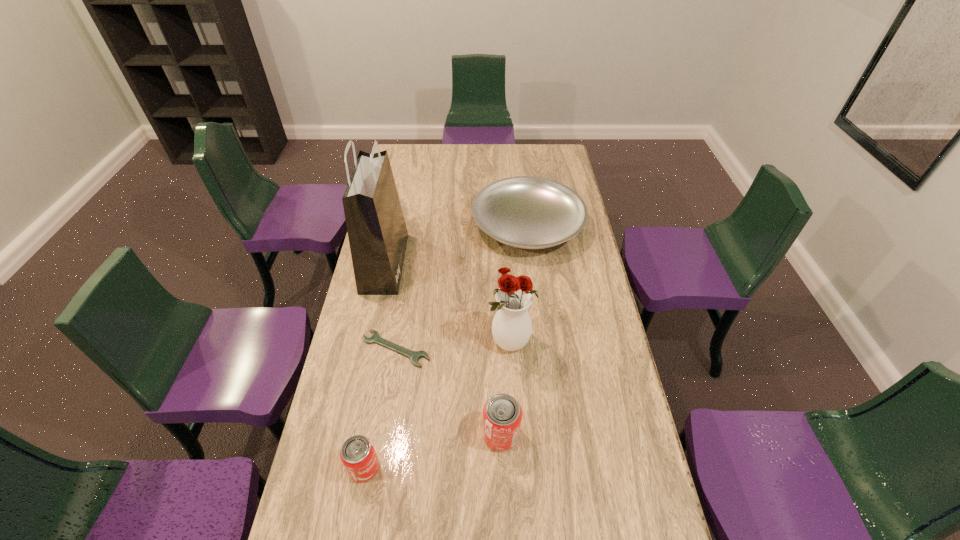
I want to click on vacant space at the left edge of the desktop, so click(321, 440).

This screenshot has width=960, height=540. In order to click on free space at the right edge of the desktop in this screenshot , I will do `click(640, 478)`.

The width and height of the screenshot is (960, 540). In order to click on vacant space at the far right corner of the desktop in this screenshot , I will do `click(544, 156)`.

Locate an element on the screen. This screenshot has height=540, width=960. free space that is in between the shorter can and the right can is located at coordinates (433, 451).

At what (x,y) coordinates should I click in order to perform the action: click on free space between the taller can and the shorter can. Please return your answer as a coordinate pair (x, y). Image resolution: width=960 pixels, height=540 pixels. Looking at the image, I should click on (433, 451).

Locate an element on the screen. Image resolution: width=960 pixels, height=540 pixels. vacant space in between the taller can and the fourth tallest object is located at coordinates (433, 451).

At what (x,y) coordinates should I click in order to perform the action: click on unoccupied position between the shortest object and the right can. Please return your answer as a coordinate pair (x, y). The width and height of the screenshot is (960, 540). Looking at the image, I should click on (448, 392).

The image size is (960, 540). Identify the location of free space between the right can and the fifth shortest object. (505, 389).

At what (x,y) coordinates should I click in order to perform the action: click on unoccupied area between the shorter can and the fifth tallest object. Please return your answer as a coordinate pair (x, y). Image resolution: width=960 pixels, height=540 pixels. Looking at the image, I should click on (446, 347).

This screenshot has height=540, width=960. In order to click on unoccupied area between the bedpan and the tallest object in this screenshot , I will do `click(456, 245)`.